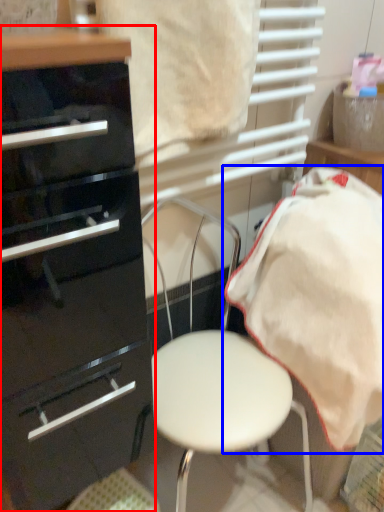
Question: Which of the following is the closest to the observer, chest of drawers (highlighted by a red box) or bedding (highlighted by a blue box)?

Choices:
 (A) chest of drawers
 (B) bedding

Answer: (A)